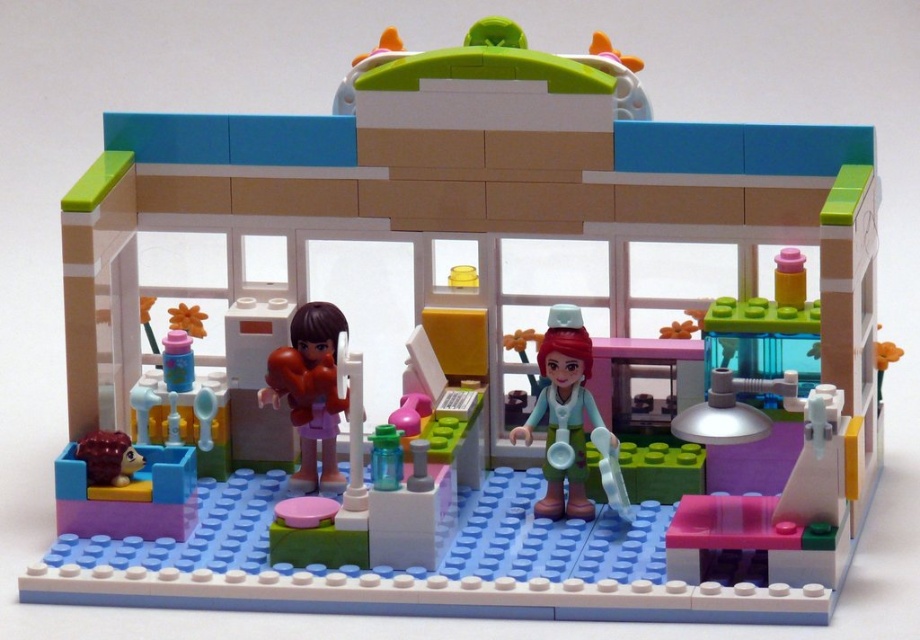
Question: Which point appears closest to the camera in this image?

Choices:
 (A) (558, 488)
 (B) (303, 472)

Answer: (A)

Question: Does smooth teal shirt at center have a smaller size compared to matte brown hair at center?

Choices:
 (A) no
 (B) yes

Answer: (A)

Question: Is smooth teal shirt at center wider than matte brown hair at center?

Choices:
 (A) no
 (B) yes

Answer: (B)

Question: Which of the following is the closest to the observer?

Choices:
 (A) smooth teal shirt at center
 (B) matte brown hair at center

Answer: (A)

Question: Is smooth teal shirt at center below matte brown hair at center?

Choices:
 (A) no
 (B) yes

Answer: (B)

Question: Among these objects, which one is nearest to the camera?

Choices:
 (A) smooth teal shirt at center
 (B) matte brown hair at center

Answer: (A)